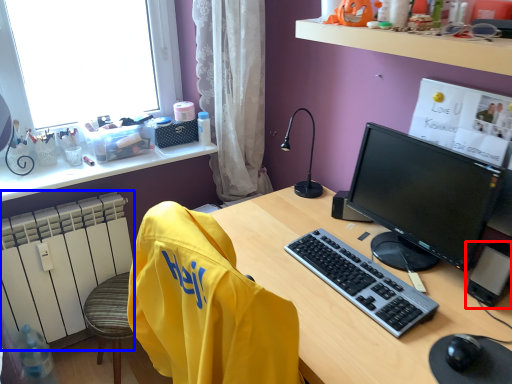
Question: Which of the following is the closest to the observer, computer tower (highlighted by a red box) or radiator (highlighted by a blue box)?

Choices:
 (A) computer tower
 (B) radiator

Answer: (A)